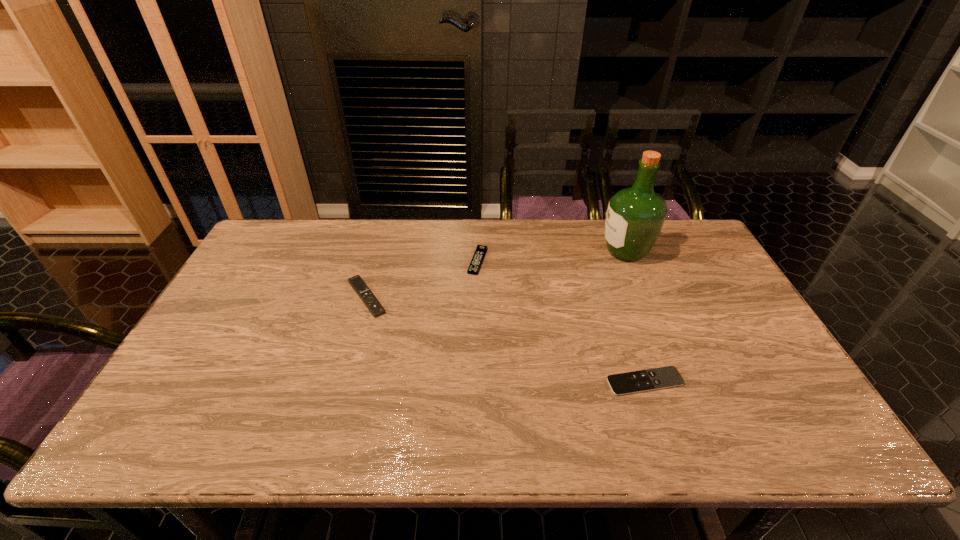
Locate an element on the screen. free spot between the second shortest remote control and the liquor is located at coordinates (552, 256).

The image size is (960, 540). What are the coordinates of `free space between the shortest object and the leftmost object` in the screenshot? It's located at (506, 340).

You are a GUI agent. You are given a task and a screenshot of the screen. Output one action in this format:
    pyautogui.click(x=<x>, y=<y>)
    Task: Click on the empty location between the second remote control from left to right and the shortest remote control
    
    Given the screenshot: What is the action you would take?
    pyautogui.click(x=562, y=321)

The image size is (960, 540). In order to click on vacant point located between the liquor and the second farthest remote control in this screenshot , I will do `click(496, 274)`.

You are a GUI agent. You are given a task and a screenshot of the screen. Output one action in this format:
    pyautogui.click(x=<x>, y=<y>)
    Task: Click on the free space that is in between the second tallest object and the second remote control from left to right
    This screenshot has width=960, height=540.
    Given the screenshot: What is the action you would take?
    pyautogui.click(x=422, y=279)

The width and height of the screenshot is (960, 540). In order to click on unoccupied area between the nearest object and the liquor in this screenshot , I will do `click(636, 316)`.

In order to click on empty location between the shortest object and the second remote control from right to left in this screenshot , I will do `click(562, 321)`.

Where is `empty space between the nearest remote control and the second object from left to right`? empty space between the nearest remote control and the second object from left to right is located at coordinates (562, 321).

This screenshot has width=960, height=540. Identify the location of free space between the shortest object and the third tallest object. (562, 321).

This screenshot has height=540, width=960. Find the location of `unoccupied position between the second nearest remote control and the farthest remote control`. unoccupied position between the second nearest remote control and the farthest remote control is located at coordinates (422, 279).